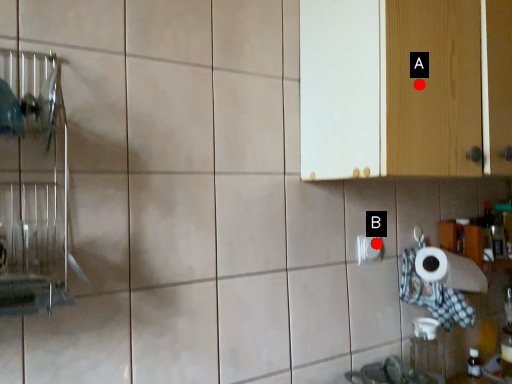
Question: Two points are circled on the image, labeled by A and B beside each circle. Which point is farther from the camera taking this photo?

Choices:
 (A) A is further
 (B) B is further

Answer: (B)